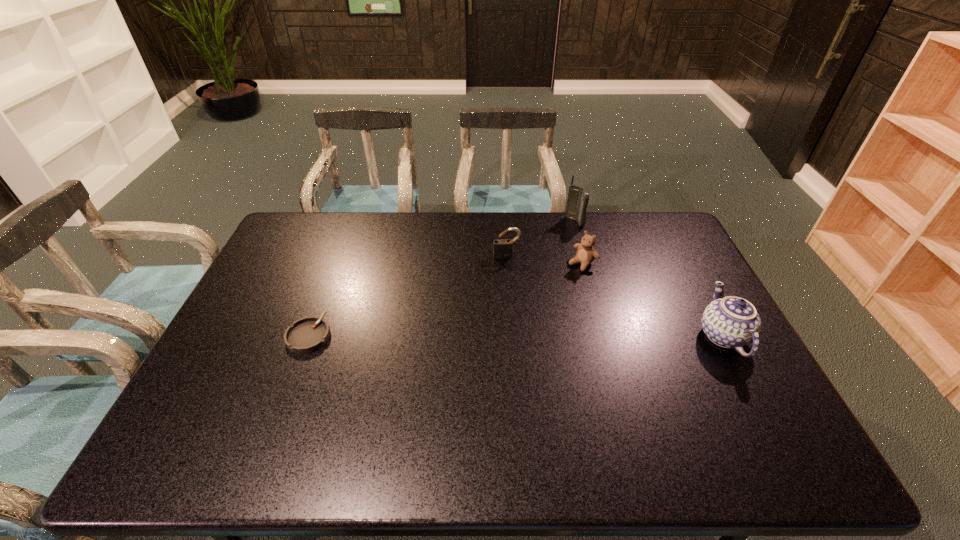
You are a GUI agent. You are given a task and a screenshot of the screen. Output one action in this format:
    pyautogui.click(x=<x>, y=<y>)
    Task: Click on the vacant spot on the desktop that is between the shortest object and the rightmost object and is positioned with the keyhole on the front of the second object from left to right
    This screenshot has width=960, height=540.
    Given the screenshot: What is the action you would take?
    pyautogui.click(x=519, y=336)

Identify the location of vacant space on the desktop that is between the leftmost object and the rightmost object and is positioned on the front-facing side of the teddy bear. This screenshot has height=540, width=960. (496, 335).

Locate an element on the screen. The width and height of the screenshot is (960, 540). vacant space on the desktop that is between the ashtray and the chinaware and is positioned on the keyboard of the cellular telephone is located at coordinates (505, 336).